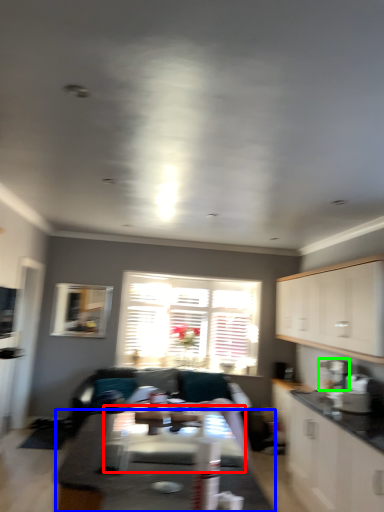
Question: Estimate the real-world distances between objects in this image. Which object is closer to table (highlighted by a red box), table (highlighted by a blue box) or appliance (highlighted by a green box)?

Choices:
 (A) table
 (B) appliance

Answer: (A)